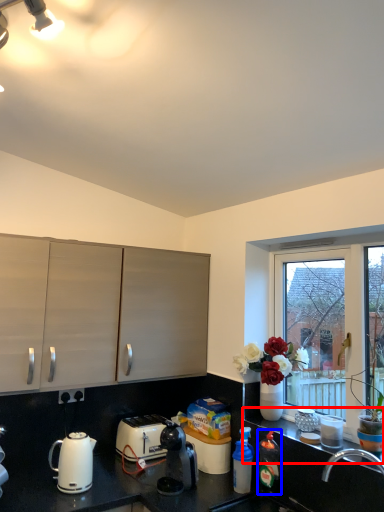
Question: Among these objects, which one is farthest to the camera, window sill (highlighted by a red box) or bottle (highlighted by a blue box)?

Choices:
 (A) window sill
 (B) bottle

Answer: (B)